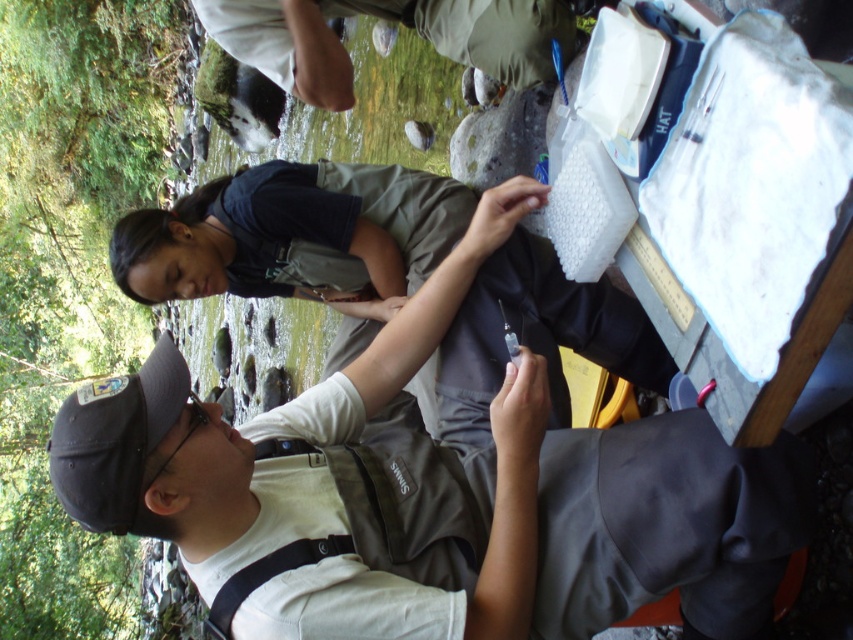
You are a photographer trying to capture a clear photo of both the matte gray vest at center and the dark gray uniform at center. Since you want both subjects to be fully visible in the frame, which one should you adjust your camera angle to focus on first to ensure the taller subject is fully captured?

The matte gray vest at center is taller than the dark gray uniform at center. To ensure both are fully visible, focus on the matte gray vest at center first as it requires more vertical space in the frame.

You are a photographer trying to capture a clear shot of the dark gray uniform at center and the light beige fabric pants at upper center. Since you want both subjects to be in focus, which one should you focus on first to ensure the other is also in focus?

You should focus on the dark gray uniform at center first because the light beige fabric pants at upper center is behind it, so adjusting focus for the closer subject will likely keep the background subject in focus as well.